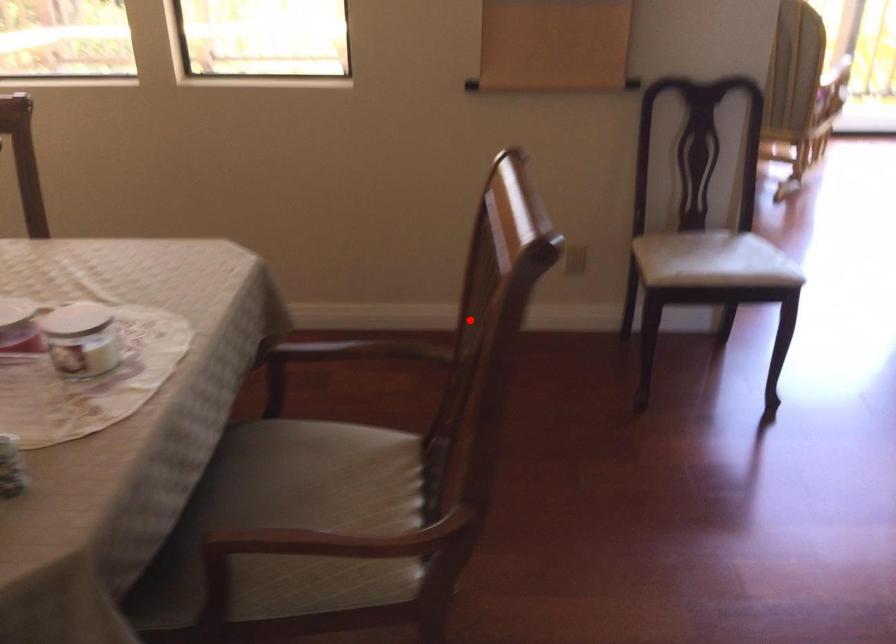
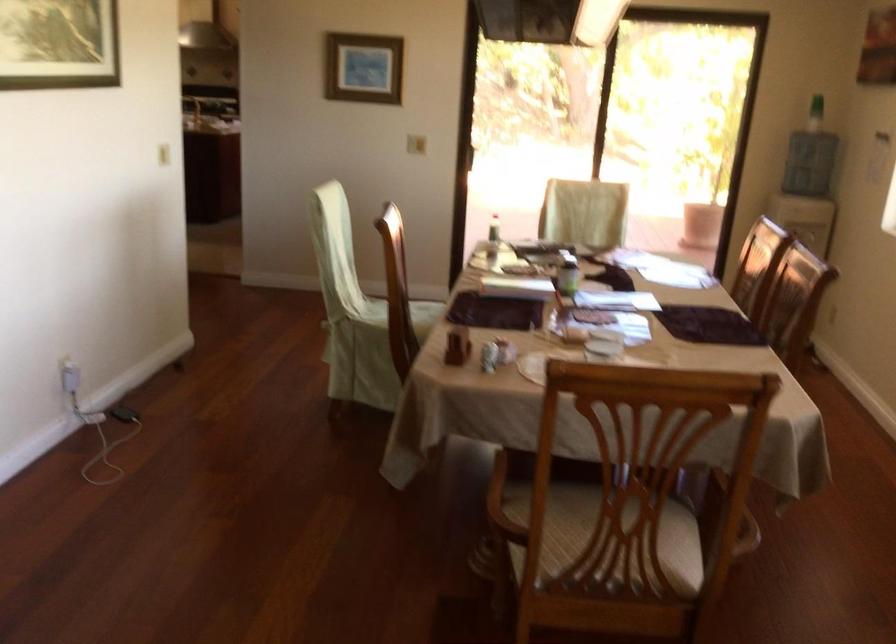
Question: I am providing you with two images of the same scene from different viewpoints. Given a red point in image1, look at the same physical point in image2. Is it:

Choices:
 (A) Closer to the viewpoint
 (B) Farther from the viewpoint

Answer: (B)